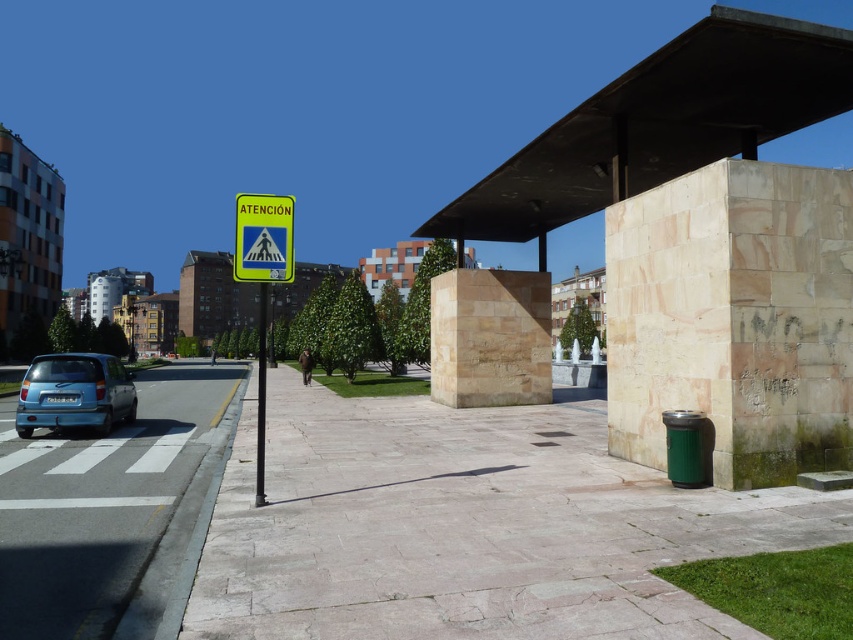
In the scene shown: Can you confirm if beige stone pillar at center is taller than yellow plastic sign at left?

No, beige stone pillar at center is not taller than yellow plastic sign at left.

Image resolution: width=853 pixels, height=640 pixels. In order to click on beige stone pillar at center in this screenshot , I will do `click(490, 337)`.

Locate an element on the screen. This screenshot has height=640, width=853. beige stone pillar at center is located at coordinates (490, 337).

How distant is smooth concrete canopy at upper right from beige stone pillar at center?

smooth concrete canopy at upper right is 5.41 meters away from beige stone pillar at center.

Where is `smooth concrete canopy at upper right`? Image resolution: width=853 pixels, height=640 pixels. smooth concrete canopy at upper right is located at coordinates (660, 124).

You are a GUI agent. You are given a task and a screenshot of the screen. Output one action in this format:
    pyautogui.click(x=<x>, y=<y>)
    Task: Click on the smooth concrete canopy at upper right
    The height and width of the screenshot is (640, 853).
    Given the screenshot: What is the action you would take?
    pyautogui.click(x=660, y=124)

Is beige stone bus stop at center taller than yellow reflective plastic sign at upper center?

Yes, beige stone bus stop at center is taller than yellow reflective plastic sign at upper center.

Can you confirm if beige stone bus stop at center is wider than yellow reflective plastic sign at upper center?

Correct, the width of beige stone bus stop at center exceeds that of yellow reflective plastic sign at upper center.

Which is in front, point (831, 358) or point (289, 260)?

Point (289, 260)

The width and height of the screenshot is (853, 640). What are the coordinates of `beige stone bus stop at center` in the screenshot? It's located at (706, 241).